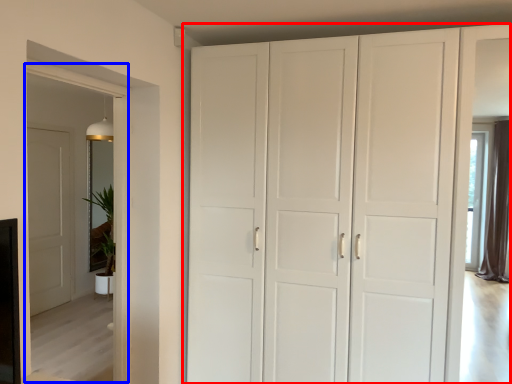
Question: Which point is closer to the camera, cupboard (highlighted by a red box) or glass door (highlighted by a blue box)?

Choices:
 (A) cupboard
 (B) glass door

Answer: (B)